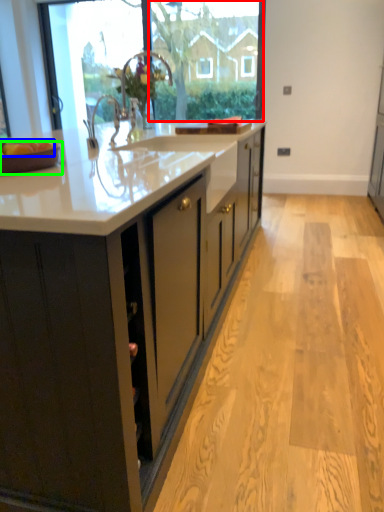
Question: Which is farther away from window screen (highlighted by a red box)? apple (highlighted by a blue box) or tray (highlighted by a green box)?

Choices:
 (A) apple
 (B) tray

Answer: (B)